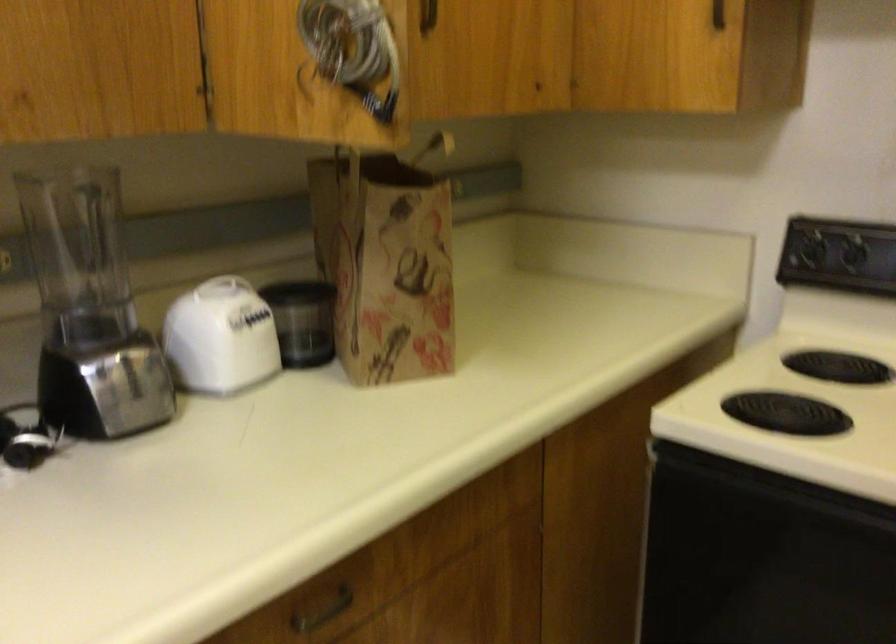
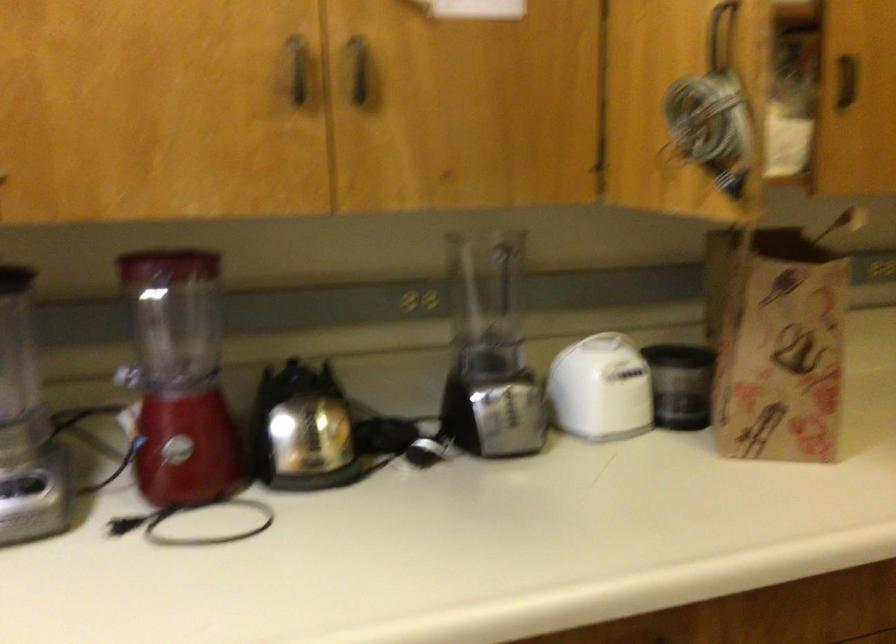
Where in the second image is the point corresponding to point 395,270 from the first image?

(777, 341)